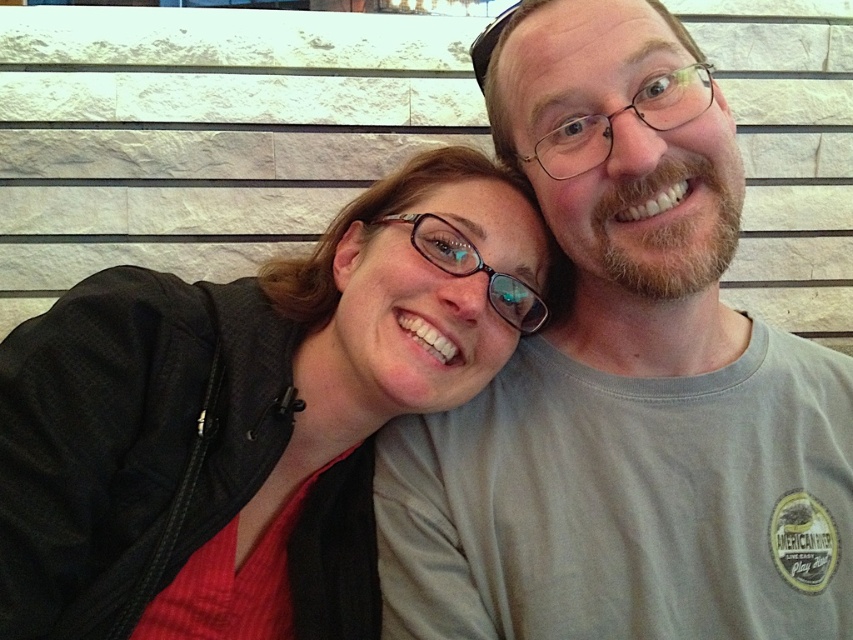
Question: Which object is closer to the camera taking this photo?

Choices:
 (A) matte black jacket at upper left
 (B) gray cotton t-shirt at center

Answer: (B)

Question: Is gray cotton t-shirt at center thinner than matte black jacket at upper left?

Choices:
 (A) no
 (B) yes

Answer: (B)

Question: Does gray cotton t-shirt at center appear on the left side of matte black jacket at upper left?

Choices:
 (A) no
 (B) yes

Answer: (A)

Question: Which point is farther to the camera?

Choices:
 (A) transparent plastic glasses at center
 (B) matte black jacket at upper left
 (C) gray cotton t-shirt at center

Answer: (A)

Question: Is gray cotton t-shirt at center above transparent plastic glasses at center?

Choices:
 (A) no
 (B) yes

Answer: (A)

Question: Among these points, which one is farthest from the camera?

Choices:
 (A) (604, 410)
 (B) (419, 212)

Answer: (A)